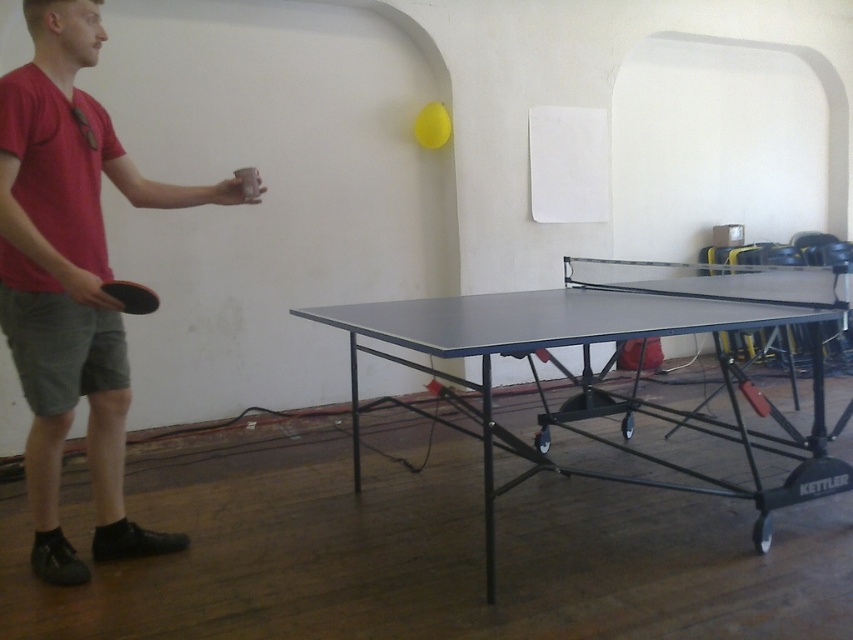
Is point (148, 547) positioned before point (723, 326)?

No, it is behind (723, 326).

How much distance is there between matte red ping pong paddle at left and matte black ping pong table at center?

matte red ping pong paddle at left and matte black ping pong table at center are 4.16 feet apart.

Does point (39, 545) come behind point (677, 486)?

No, (39, 545) is closer to viewer.

Where is `matte red ping pong paddle at left`? The width and height of the screenshot is (853, 640). matte red ping pong paddle at left is located at coordinates (71, 278).

Can you confirm if matte red ping pong paddle at left is taller than black rubber paddle at left?

Yes, matte red ping pong paddle at left is taller than black rubber paddle at left.

Does matte red ping pong paddle at left appear over black rubber paddle at left?

Yes.

Where is `matte red ping pong paddle at left`? matte red ping pong paddle at left is located at coordinates (71, 278).

Between matte black ping pong table at center and black rubber paddle at left, which one appears on the right side from the viewer's perspective?

Positioned to the right is matte black ping pong table at center.

Which is more to the left, matte black ping pong table at center or black rubber paddle at left?

black rubber paddle at left

Between point (807, 304) and point (136, 304), which one is positioned behind?

The point (807, 304) is more distant.

Image resolution: width=853 pixels, height=640 pixels. I want to click on matte black ping pong table at center, so click(602, 340).